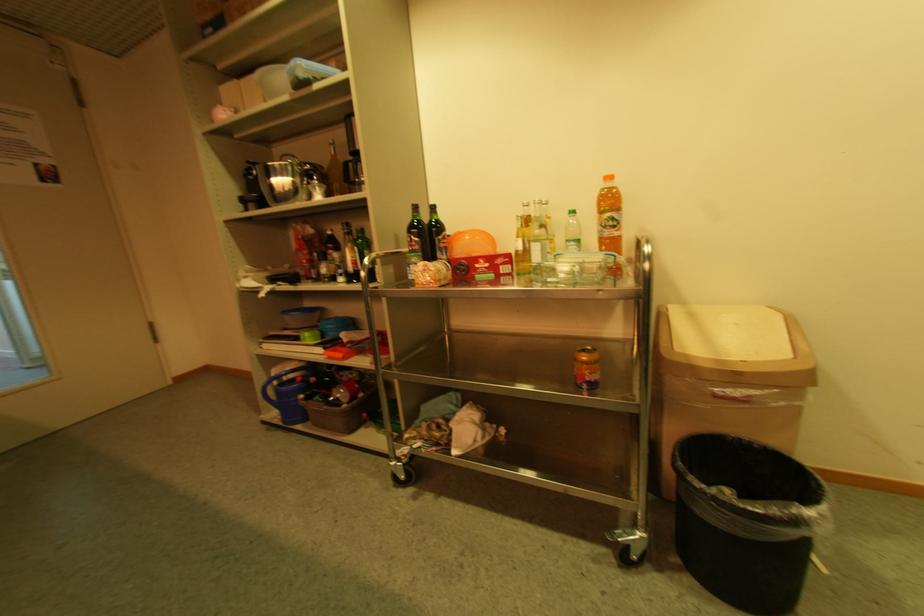
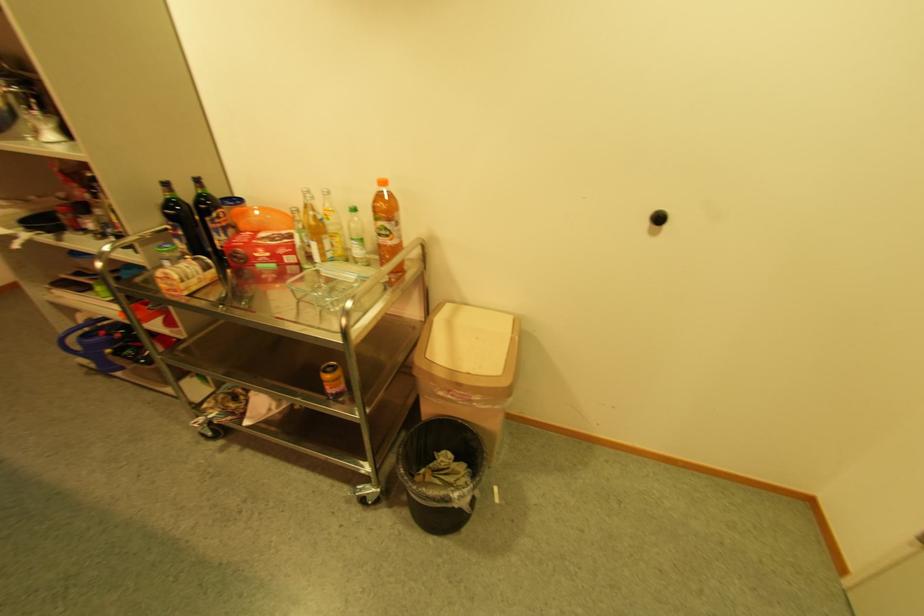
Locate, in the second image, the point that corresponds to point 497,276 in the first image.

(278, 267)